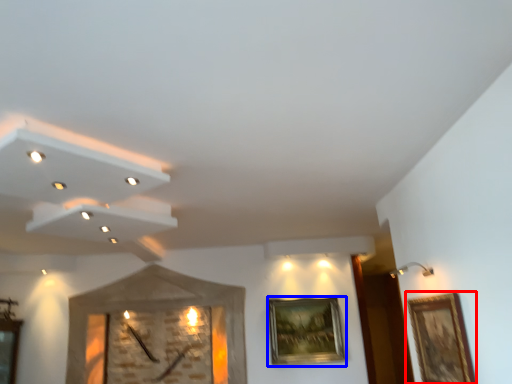
Question: Among these objects, which one is farthest to the camera, picture frame (highlighted by a red box) or picture frame (highlighted by a blue box)?

Choices:
 (A) picture frame
 (B) picture frame

Answer: (B)